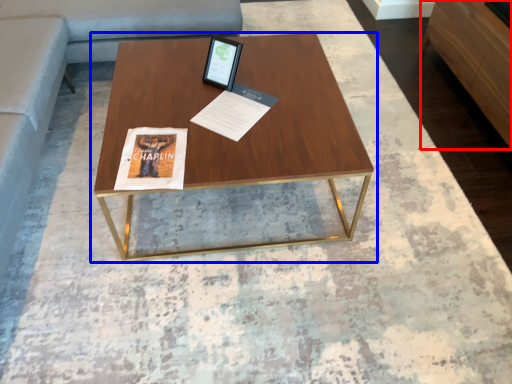
Question: Which object appears farthest to the camera in this image, furniture (highlighted by a red box) or coffee table (highlighted by a blue box)?

Choices:
 (A) furniture
 (B) coffee table

Answer: (A)